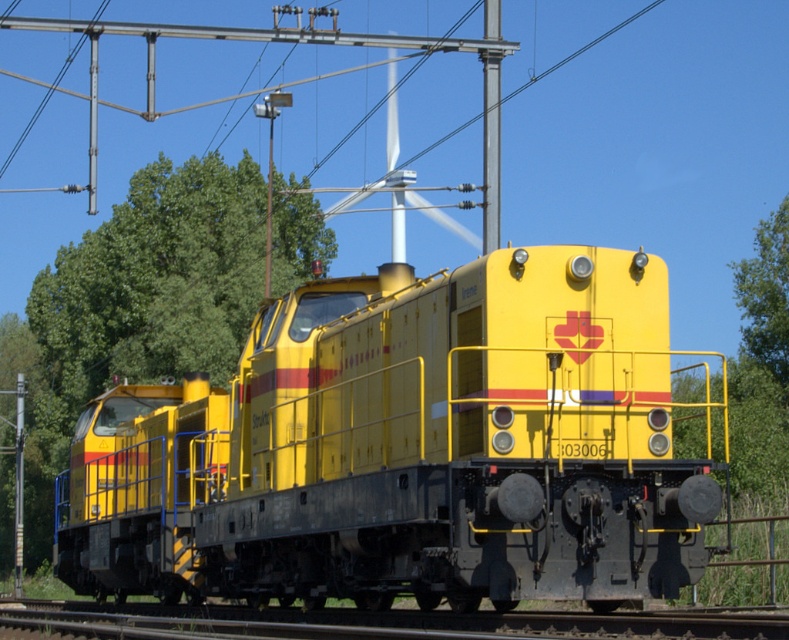
Does yellow matte train at center appear under metallic pole at upper center?

Indeed, yellow matte train at center is positioned under metallic pole at upper center.

Is point (346, 593) more distant than point (492, 17)?

No, (346, 593) is closer to viewer.

Which is behind, point (586, 250) or point (485, 157)?

Positioned behind is point (485, 157).

Where is `yellow matte train at center`? yellow matte train at center is located at coordinates (406, 449).

Who is positioned more to the right, green leafy tree at left or metallic pole at upper center?

metallic pole at upper center

Does green leafy tree at left have a lesser width compared to metallic pole at upper center?

No.

Between point (92, 392) and point (495, 76), which one is positioned behind?

Positioned behind is point (92, 392).

Locate an element on the screen. Image resolution: width=789 pixels, height=640 pixels. green leafy tree at left is located at coordinates [135, 307].

Is yellow matte train at center below green leafy tree at left?

Correct, yellow matte train at center is located below green leafy tree at left.

Is yellow matte train at center to the left of green leafy tree at left from the viewer's perspective?

Incorrect, yellow matte train at center is not on the left side of green leafy tree at left.

This screenshot has width=789, height=640. Find the location of `yellow matte train at center`. yellow matte train at center is located at coordinates click(406, 449).